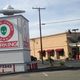
This screenshot has height=80, width=80. I want to click on window, so click(61, 52), click(51, 53), click(44, 54).